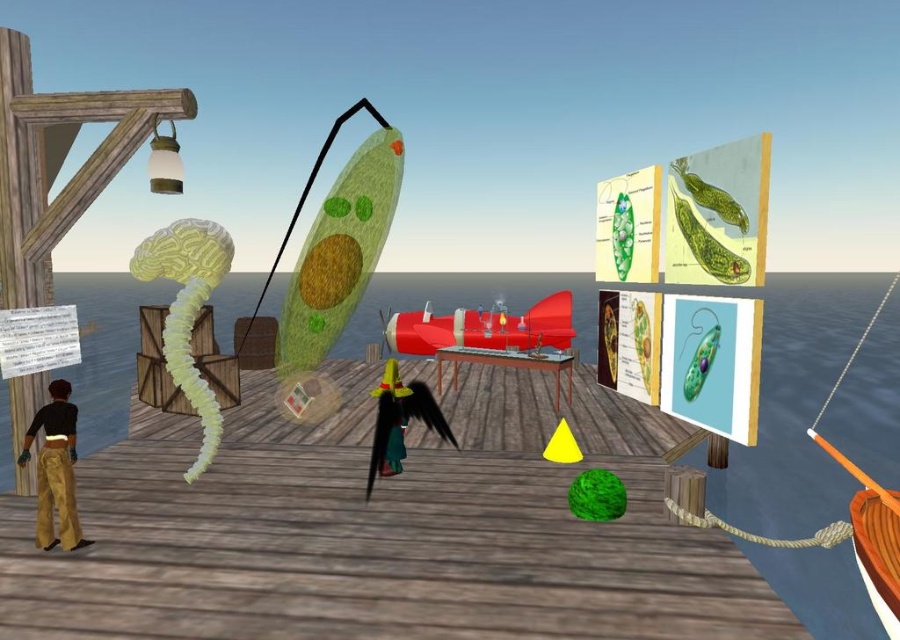
Who is more forward, (x=69, y=500) or (x=858, y=528)?

Point (x=69, y=500) is more forward.

Is gold textured pants at lower left closer to camera compared to wooden boat at lower right?

No, it is not.

This screenshot has width=900, height=640. In order to click on gold textured pants at lower left in this screenshot , I will do `click(55, 468)`.

Is point (860, 424) positioned behind point (74, 525)?

Yes.

Can you confirm if transparent water at center is shorter than gold textured pants at lower left?

No, transparent water at center is not shorter than gold textured pants at lower left.

Who is more distant from viewer, (360, 323) or (72, 449)?

The point (360, 323) is more distant.

Where is `transparent water at center`? This screenshot has height=640, width=900. transparent water at center is located at coordinates (795, 406).

Can you confirm if shiny red submarine at center is positioned to the left of gold textured pants at lower left?

In fact, shiny red submarine at center is to the right of gold textured pants at lower left.

Which of these two, shiny red submarine at center or gold textured pants at lower left, stands shorter?

With less height is gold textured pants at lower left.

Is point (484, 324) positioned in front of point (74, 458)?

No, it is behind (74, 458).

The width and height of the screenshot is (900, 640). I want to click on shiny red submarine at center, so click(x=483, y=326).